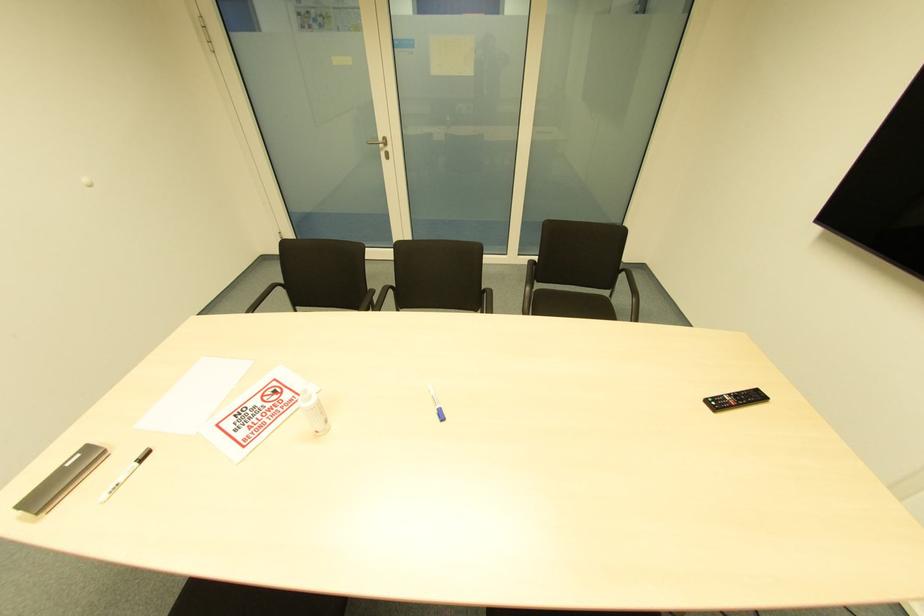
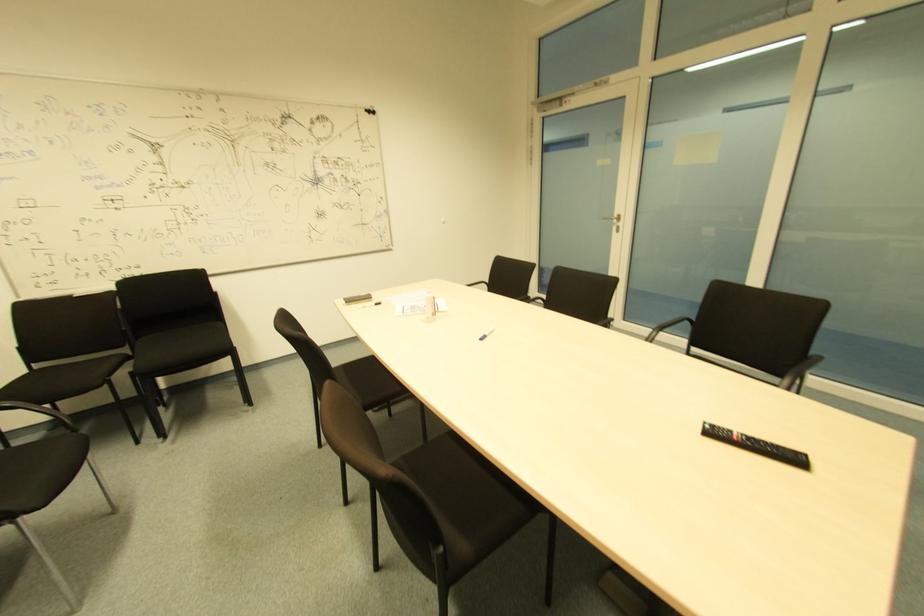
In the second image, find the point that corresponds to point (90, 459) in the first image.

(365, 301)